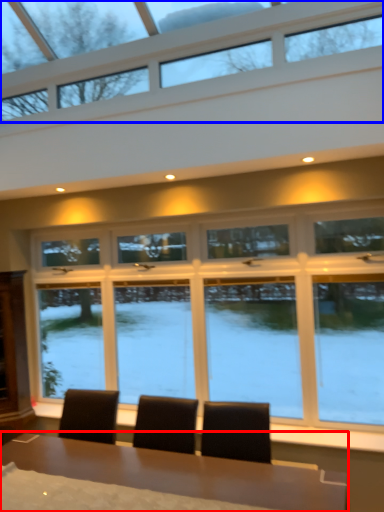
Question: Which of the following is the closest to the observer, table (highlighted by a red box) or window (highlighted by a blue box)?

Choices:
 (A) table
 (B) window

Answer: (B)